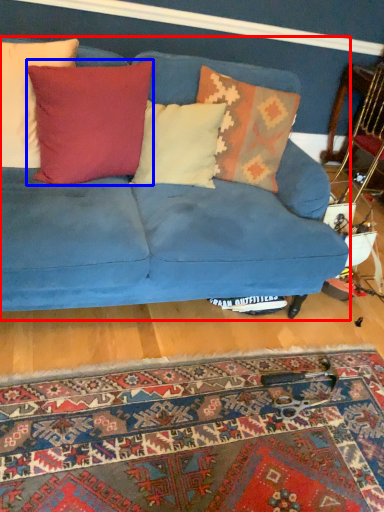
Question: Which object is further to the camera taking this photo, studio couch (highlighted by a red box) or pillow (highlighted by a blue box)?

Choices:
 (A) studio couch
 (B) pillow

Answer: (B)